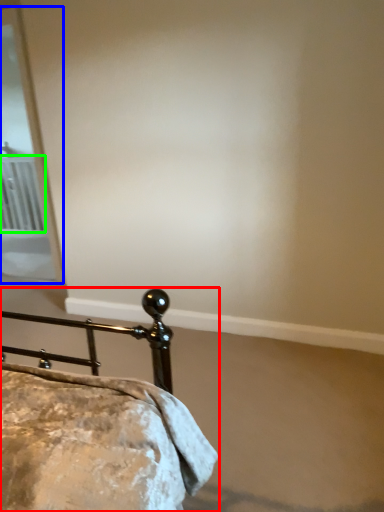
Question: Estimate the real-world distances between objects in this image. Which object is closer to bed (highlighted by a red box), screen door (highlighted by a blue box) or radiator (highlighted by a green box)?

Choices:
 (A) screen door
 (B) radiator

Answer: (A)